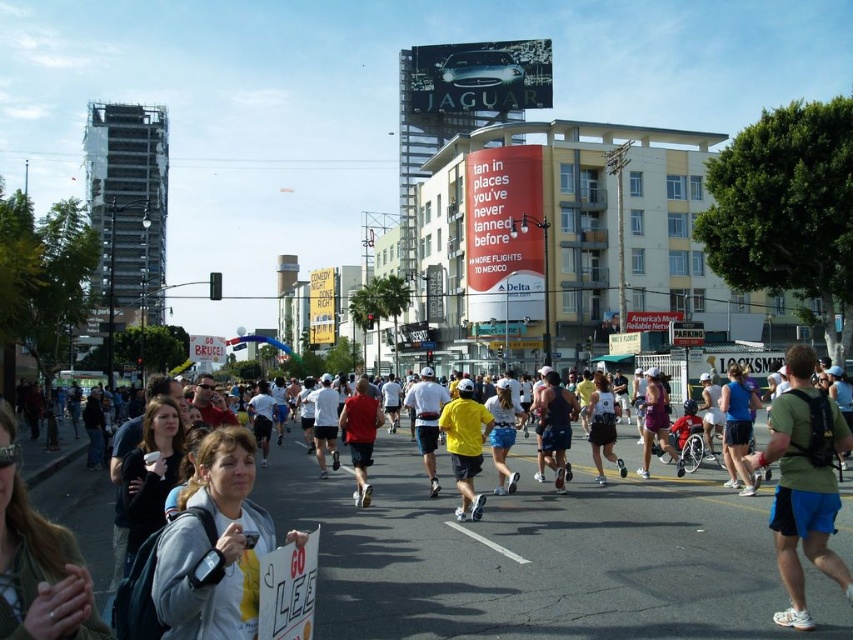
Does red matte shirt at center appear over matte purple shorts at center?

Correct, red matte shirt at center is located above matte purple shorts at center.

You are a GUI agent. You are given a task and a screenshot of the screen. Output one action in this format:
    pyautogui.click(x=<x>, y=<y>)
    Task: Click on the red matte shirt at center
    The width and height of the screenshot is (853, 640).
    Given the screenshot: What is the action you would take?
    pyautogui.click(x=360, y=435)

Between point (355, 451) and point (666, 401), which one is positioned in front?

Point (355, 451) is in front.

Identify the location of red matte shirt at center. Image resolution: width=853 pixels, height=640 pixels. point(360,435).

Does green fabric shirt at center appear on the left side of blue fabric shorts at center?

Yes, green fabric shirt at center is to the left of blue fabric shorts at center.

In the scene shown: Can you confirm if green fabric shirt at center is wider than blue fabric shorts at center?

Yes.

Who is more distant from viewer, (x=798, y=588) or (x=726, y=404)?

The point (x=726, y=404) is behind.

I want to click on green fabric shirt at center, so click(804, 483).

Does white cotton shirt at center have a lesser height compared to white fabric jacket at center?

Correct, white cotton shirt at center is not as tall as white fabric jacket at center.

Who is positioned more to the left, white cotton shirt at center or white fabric jacket at center?

white fabric jacket at center is more to the left.

Identify the location of white cotton shirt at center. (538, 557).